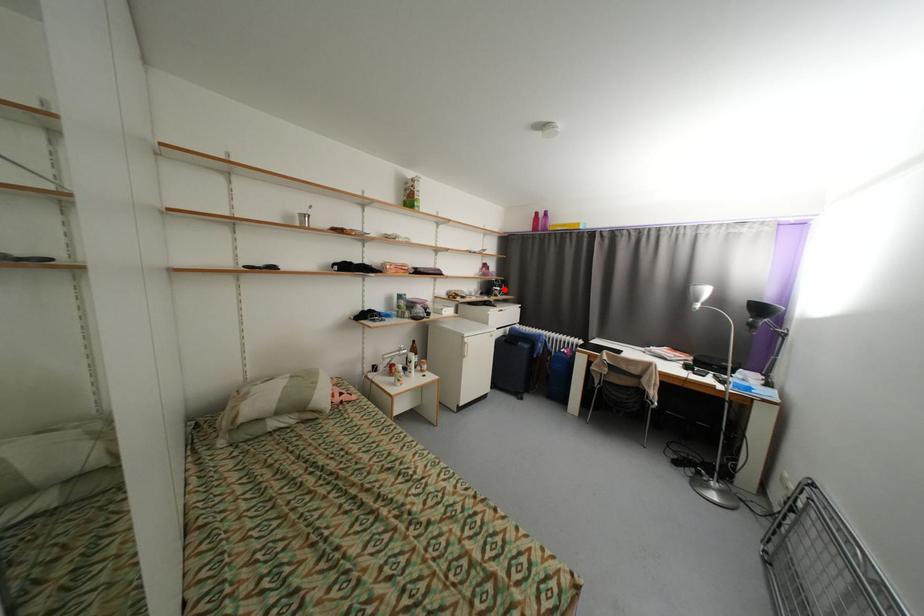
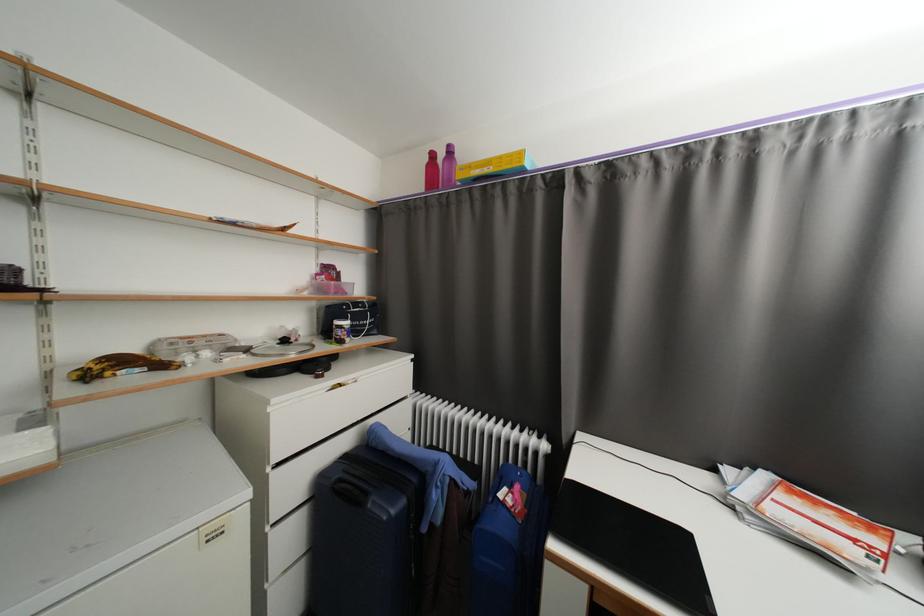
Locate, in the second image, the point that corresponds to the highlighted location in the first image.

(353, 323)